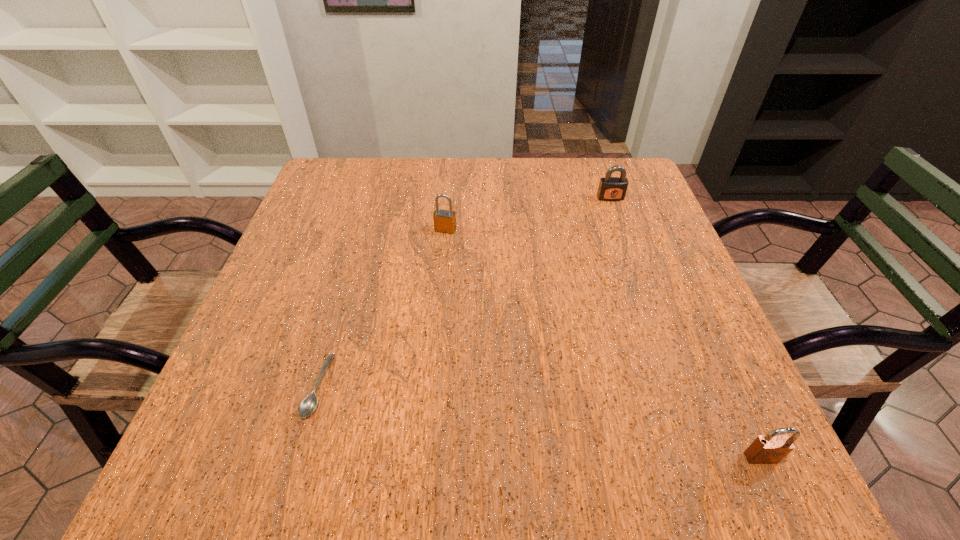
The width and height of the screenshot is (960, 540). In order to click on vacant area that lies between the rightmost padlock and the farthest padlock in this screenshot , I will do `click(685, 328)`.

The image size is (960, 540). Identify the location of empty space between the leftmost padlock and the second nearest object. (381, 308).

Locate an element on the screen. Image resolution: width=960 pixels, height=540 pixels. free space between the nearest object and the second object from left to right is located at coordinates (603, 343).

I want to click on object that is the second closest one to the nearest object, so click(308, 405).

Choose which object is the second nearest neighbor to the nearest padlock. Please provide its 2D coordinates. Your answer should be formatted as a tuple, i.e. [(x, y)], where the tuple contains the x and y coordinates of a point satisfying the conditions above.

[(308, 405)]

Identify which padlock is the closest to the nearest object. Please provide its 2D coordinates. Your answer should be formatted as a tuple, i.e. [(x, y)], where the tuple contains the x and y coordinates of a point satisfying the conditions above.

[(610, 188)]

Locate an element on the screen. The width and height of the screenshot is (960, 540). the second closest padlock to the soupspoon is located at coordinates (772, 448).